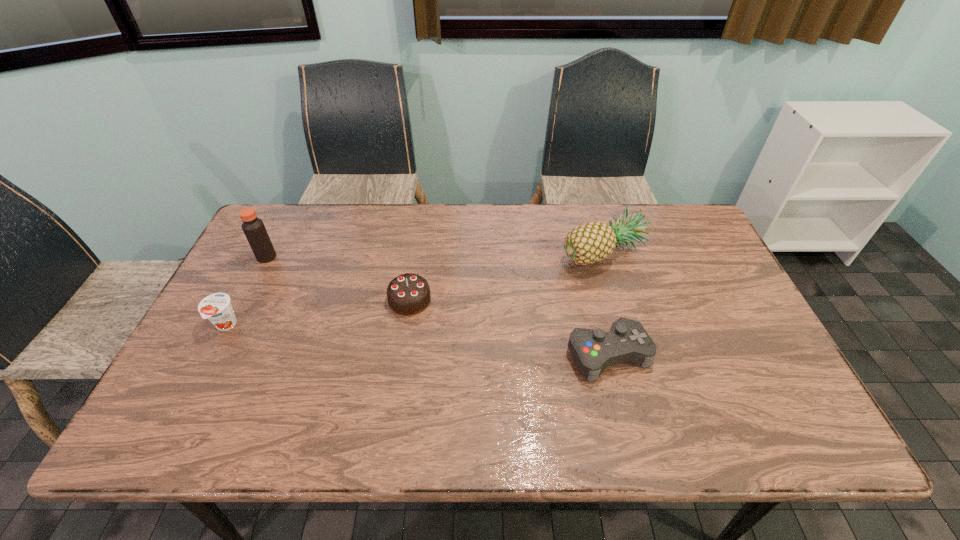
Image resolution: width=960 pixels, height=540 pixels. Find the location of `object that is at the far edge`. object that is at the far edge is located at coordinates (591, 242).

Image resolution: width=960 pixels, height=540 pixels. In order to click on vinegar located at the left edge in this screenshot , I will do `click(253, 227)`.

Where is `yogurt that is at the left edge`? This screenshot has height=540, width=960. yogurt that is at the left edge is located at coordinates (216, 307).

The height and width of the screenshot is (540, 960). What are the coordinates of `vacant space at the far edge` in the screenshot? It's located at (537, 237).

Identify the location of vacant area at the near edge. (645, 442).

You are a GUI agent. You are given a task and a screenshot of the screen. Output one action in this format:
    pyautogui.click(x=<x>, y=<y>)
    Task: Click on the free space at the left edge of the desktop
    This screenshot has width=960, height=540.
    Given the screenshot: What is the action you would take?
    pyautogui.click(x=262, y=269)

Find the location of a particular element. blank space at the right edge of the desktop is located at coordinates (x=725, y=277).

Identify the location of vacant space at the far right corner. The height and width of the screenshot is (540, 960). (694, 246).

At what (x,y) coordinates should I click in order to perform the action: click on free spot between the control and the pineapple. Please return your answer as a coordinate pair (x, y). This screenshot has width=960, height=540. Looking at the image, I should click on (606, 303).

At what (x,y) coordinates should I click in order to perform the action: click on free space that is in between the yogurt and the control. Please return your answer as a coordinate pair (x, y). Looking at the image, I should click on (417, 340).